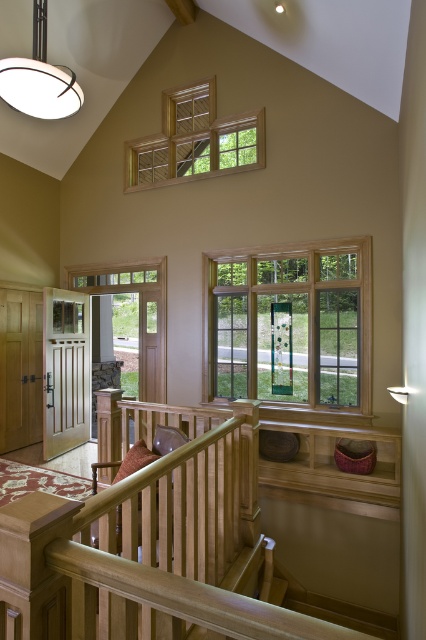
You are a delivery person carrying a large package that is 10 feet long. You need to move it through the space between the wooden balustrade at center and the clear glass door at left. Can the package fit through the space between them?

The wooden balustrade at center and clear glass door at left are 11.03 feet apart from each other. Since the package is 10 feet long, it can fit through the space between them as the distance is sufficient.

You are standing at the bottom of the staircase and want to go to the upper floor. You notice a clear glass window at center and a clear glass door at left. Which one is closer to you?

The clear glass window at center is closer to the viewer than the clear glass door at left.

You are moving a large painting that is 1.2 meters wide. You need to carry it through the space between the wooden rail at center and the clear glass window at upper center. Can the painting fit through this space?

The wooden rail at center has a lesser width compared to the clear glass window at upper center, so the painting that is 1.2 meters wide may not fit through the space between them. The width of the wooden rail is narrower than the window, so the space might be too narrow for the painting.